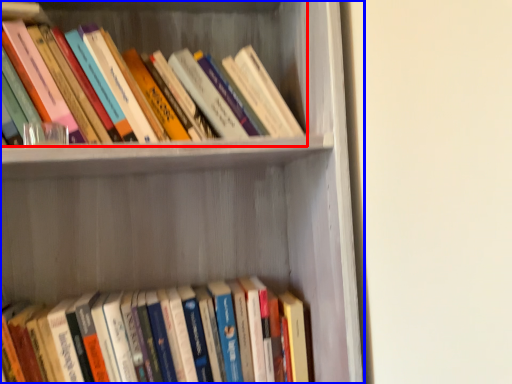
Question: Among these objects, which one is nearest to the camera, book (highlighted by a red box) or shelf (highlighted by a blue box)?

Choices:
 (A) book
 (B) shelf

Answer: (B)